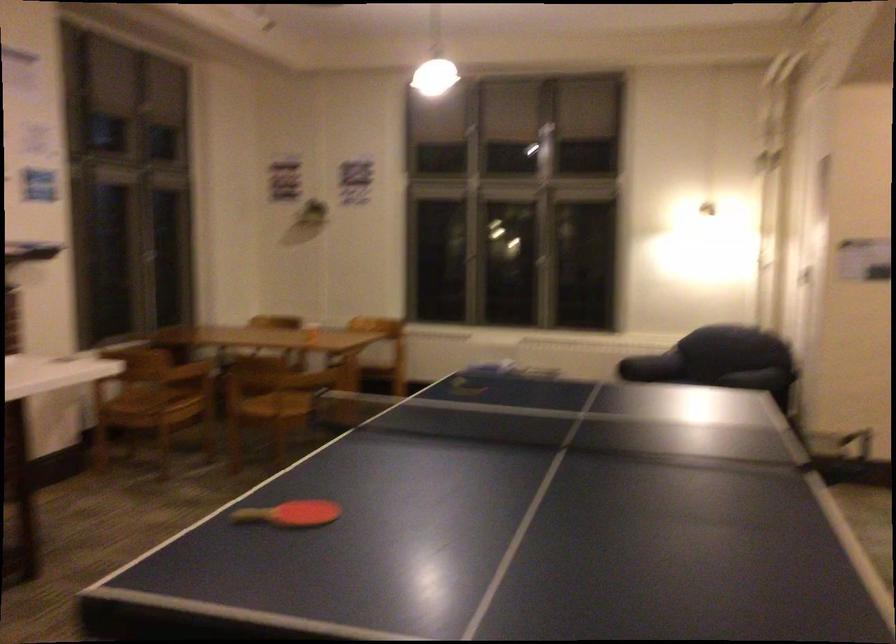
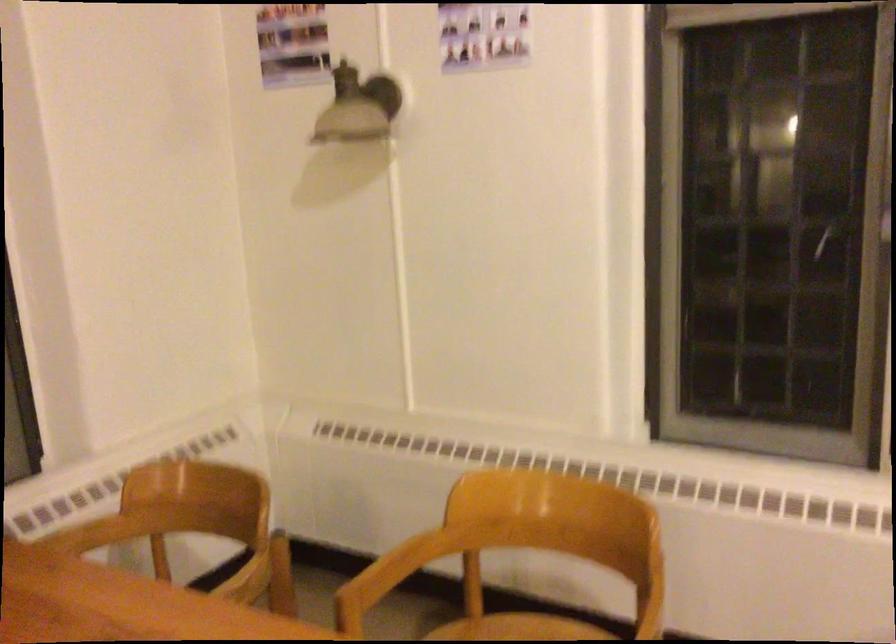
Find the pixel in the second image that matches point 376,354 in the first image.

(517, 629)